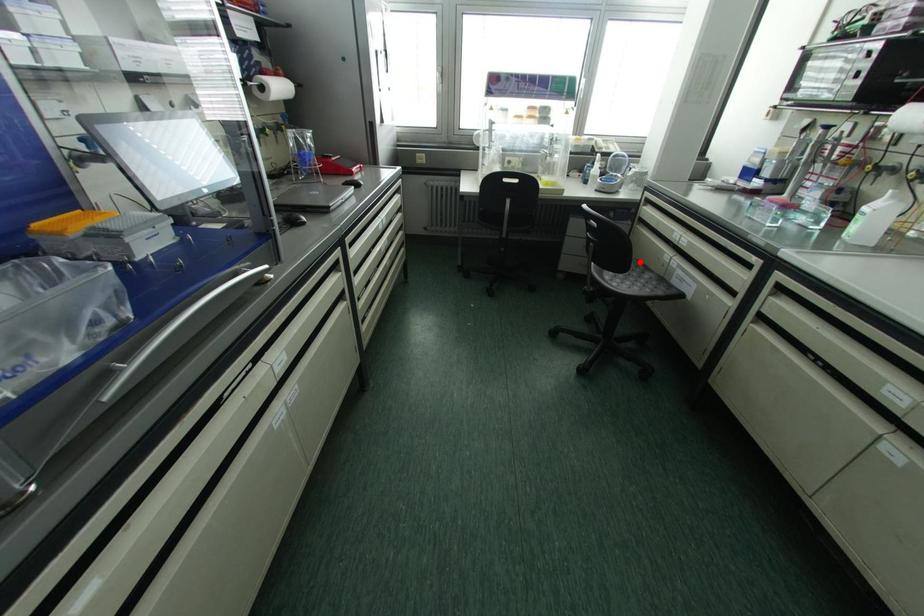
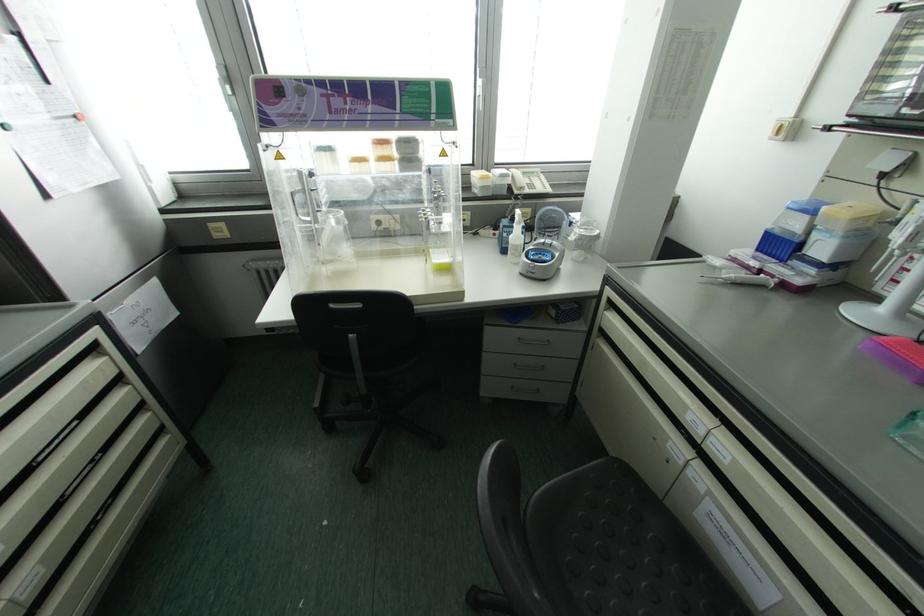
Question: I am providing you with two images of the same scene from different viewpoints. A red point is marked on the first image. Can you still see the location of the red point in image 2?

Choices:
 (A) Yes
 (B) No

Answer: (A)